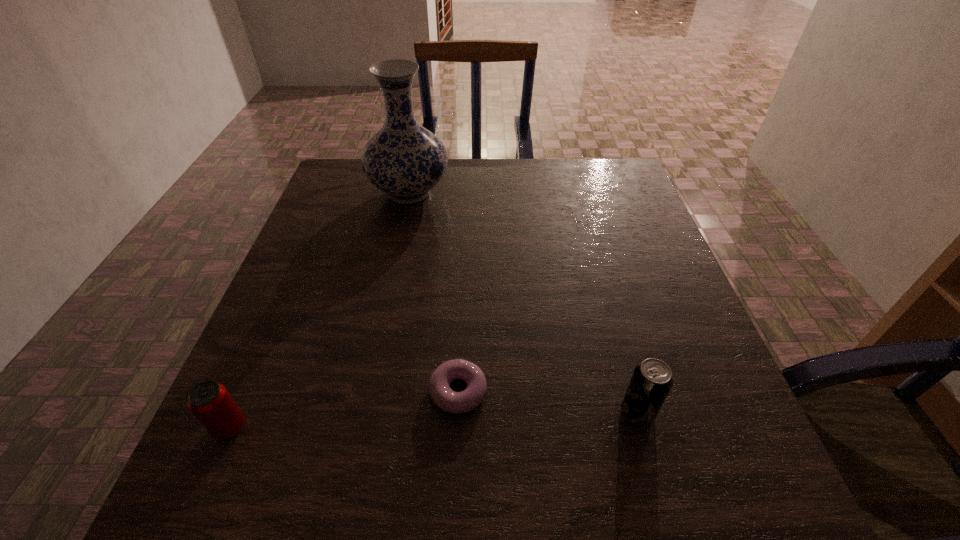
You are a GUI agent. You are given a task and a screenshot of the screen. Output one action in this format:
    pyautogui.click(x=<x>, y=<y>)
    Task: Click on the vacant region between the third tallest object and the rightmost object
    
    Given the screenshot: What is the action you would take?
    pyautogui.click(x=434, y=420)

Identify the location of object that stands as the closest to the leftmost object. (452, 402).

Locate an element on the screen. The height and width of the screenshot is (540, 960). object identified as the second closest to the doughnut is located at coordinates (210, 402).

Find the location of `vacant region that satisfies the following two spatial constraints: 1. on the back side of the shortest object; 2. on the left side of the leftmost object`. vacant region that satisfies the following two spatial constraints: 1. on the back side of the shortest object; 2. on the left side of the leftmost object is located at coordinates pos(245,392).

The image size is (960, 540). I want to click on free location that satisfies the following two spatial constraints: 1. on the back side of the rightmost object; 2. on the left side of the second shortest object, so click(236, 412).

Where is `free region that satisfies the following two spatial constraints: 1. on the front side of the rightmost object; 2. on the left side of the doughnut`? The height and width of the screenshot is (540, 960). free region that satisfies the following two spatial constraints: 1. on the front side of the rightmost object; 2. on the left side of the doughnut is located at coordinates (457, 412).

Identify the location of vacant space that satisfies the following two spatial constraints: 1. on the back side of the second shortest object; 2. on the left side of the rightmost object. This screenshot has height=540, width=960. (236, 412).

The width and height of the screenshot is (960, 540). I want to click on free point that satisfies the following two spatial constraints: 1. on the back side of the soda can; 2. on the right side of the leftmost object, so click(236, 412).

At what (x,y) coordinates should I click in order to perform the action: click on vacant space that satisfies the following two spatial constraints: 1. on the back side of the shortest object; 2. on the left side of the leftmost object. Please return your answer as a coordinate pair (x, y). Looking at the image, I should click on (x=245, y=392).